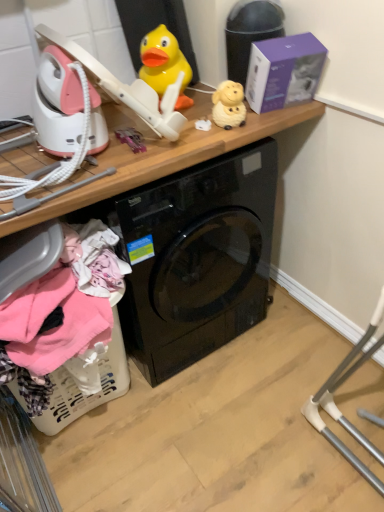
Where is `free location in front of matte yellow sheep at upper center, placed as the 2th toy when sorted from left to right`? free location in front of matte yellow sheep at upper center, placed as the 2th toy when sorted from left to right is located at coordinates (225, 137).